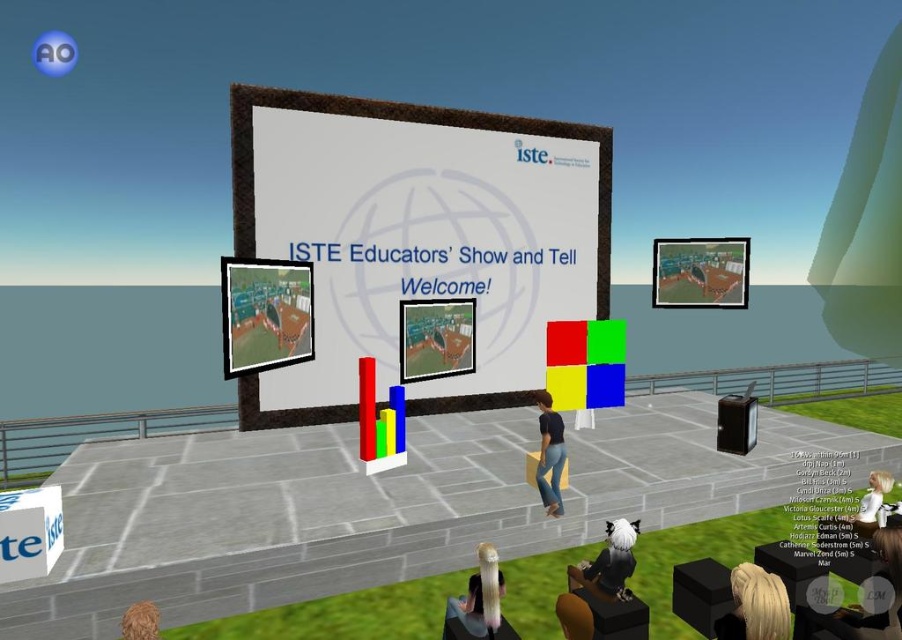
Question: Which is farther from the matte plastic screen at center?

Choices:
 (A) blonde hair at lower right
 (B) black hair at lower center

Answer: (B)

Question: Which object appears closest to the camera in this image?

Choices:
 (A) matte plastic screen at center
 (B) fluffy brown hair at lower left
 (C) blonde hair at lower right

Answer: (B)

Question: In this image, where is black hair at lower center located relative to white matte shirt at lower right?

Choices:
 (A) above
 (B) below

Answer: (B)

Question: Among these points, which one is farthest from the camera?

Choices:
 (A) (879, 486)
 (B) (627, 589)
 (C) (741, 289)
 (D) (477, 604)

Answer: (A)

Question: Observing the image, what is the correct spatial positioning of metallic silver screen at upper center in reference to matte plastic screen at center?

Choices:
 (A) below
 (B) above

Answer: (B)

Question: Is matte plastic screen at upper center bigger than blonde hair at lower center?

Choices:
 (A) no
 (B) yes

Answer: (B)